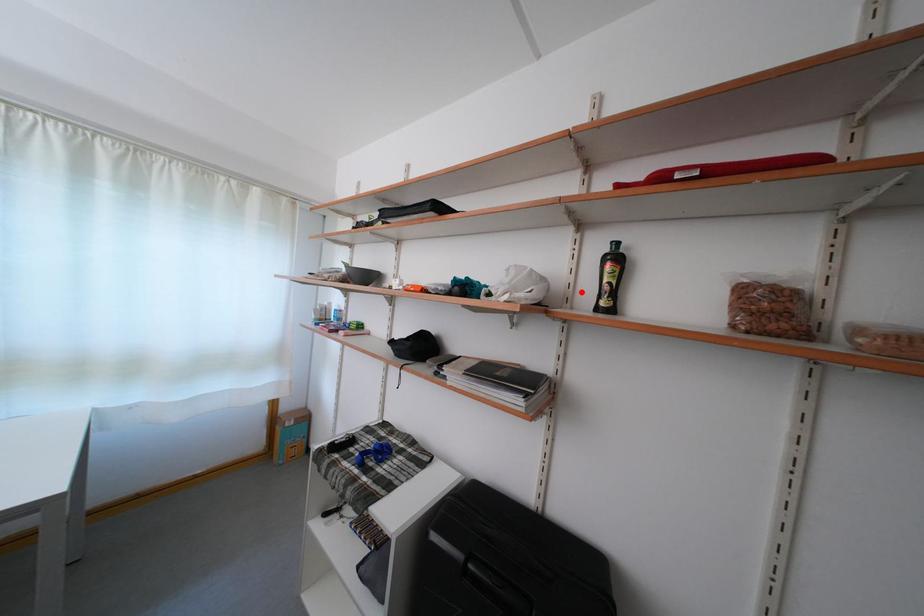
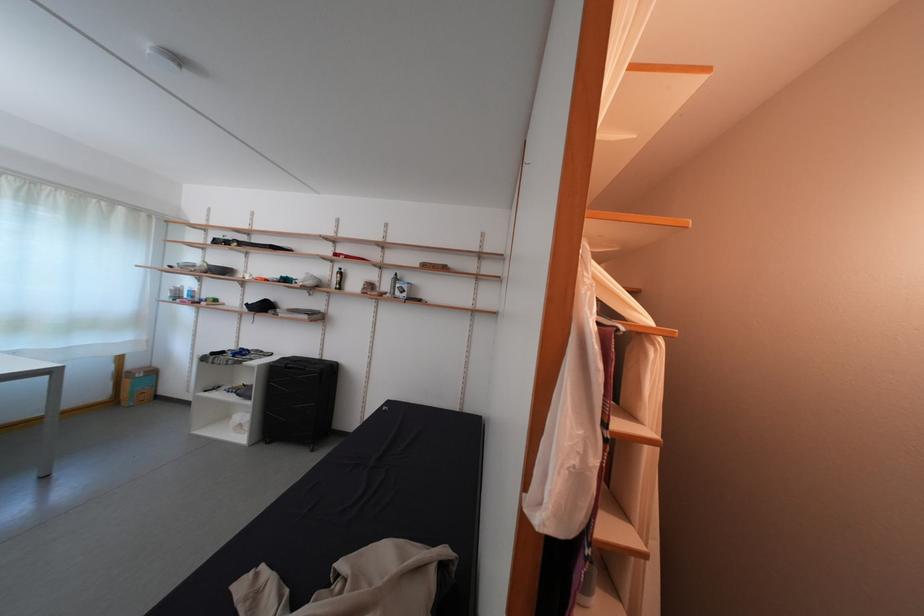
The point at the highlighted location is marked in the first image. Where is the corresponding point in the second image?

(339, 286)